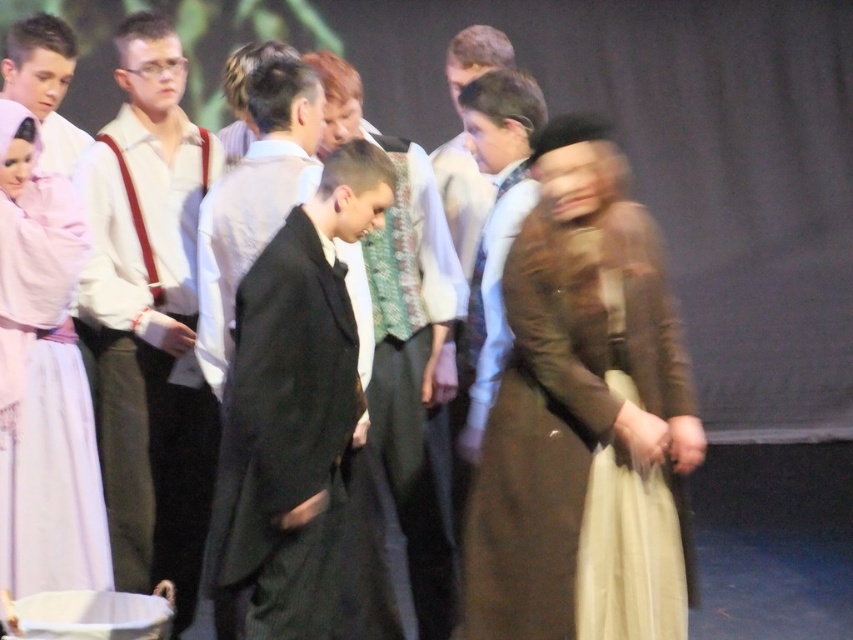
Is brown textured coat at center taller than pale pink satin dress at left?

Correct, brown textured coat at center is much taller as pale pink satin dress at left.

Between brown textured coat at center and pale pink satin dress at left, which one has less height?

Standing shorter between the two is pale pink satin dress at left.

Is point (579, 148) closer to camera compared to point (71, 500)?

Yes, point (579, 148) is closer to viewer.

Locate an element on the screen. The image size is (853, 640). brown textured coat at center is located at coordinates (579, 397).

Between brown textured coat at center and black woolen suit at center, which one appears on the right side from the viewer's perspective?

Positioned to the right is brown textured coat at center.

Is brown textured coat at center positioned in front of black woolen suit at center?

No, it is behind black woolen suit at center.

This screenshot has height=640, width=853. What do you see at coordinates (579, 397) in the screenshot? I see `brown textured coat at center` at bounding box center [579, 397].

At what (x,y) coordinates should I click in order to perform the action: click on brown textured coat at center. Please return your answer as a coordinate pair (x, y). The width and height of the screenshot is (853, 640). Looking at the image, I should click on (579, 397).

Which is more to the left, black woolen suit at center or pale pink satin dress at left?

Positioned to the left is pale pink satin dress at left.

Measure the distance between point (x=325, y=320) and camera.

Point (x=325, y=320) is 9.67 feet from camera.

Who is more distant from viewer, (326,349) or (4,417)?

The point (4,417) is behind.

I want to click on black woolen suit at center, so click(x=286, y=435).